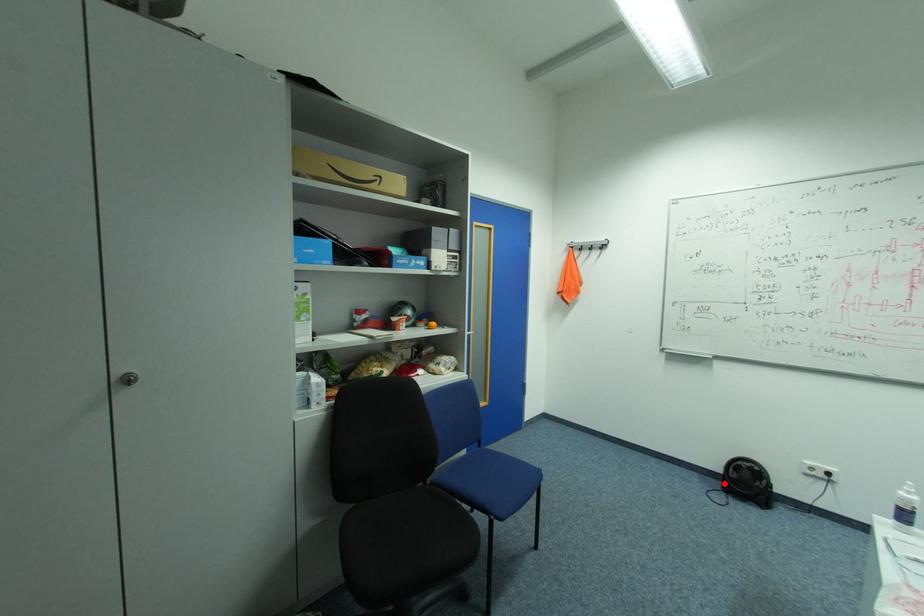
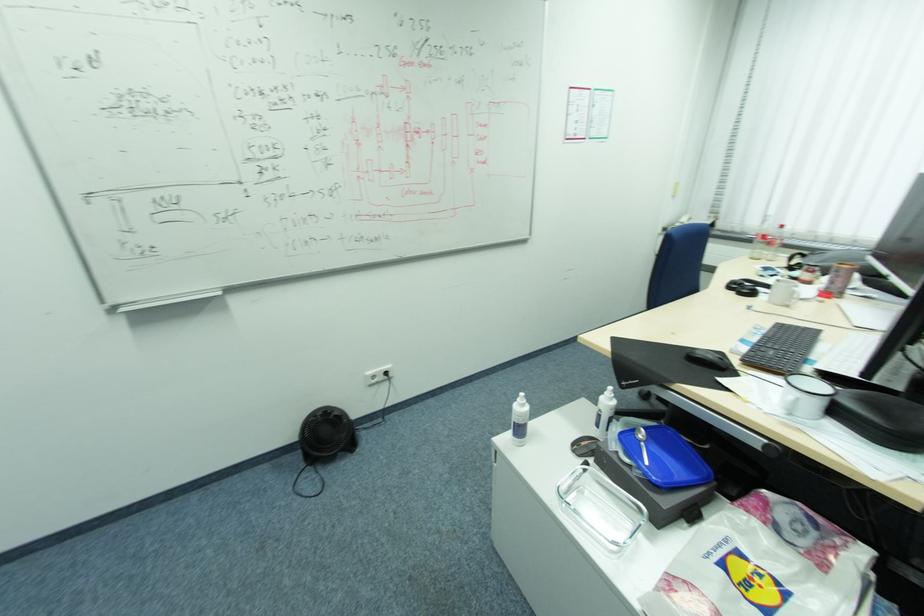
The point at the highlighted location is marked in the first image. Where is the corresponding point in the second image?

(304, 456)